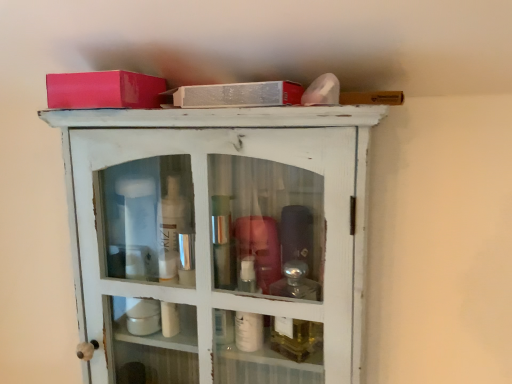
Question: From a real-world perspective, relative to white distressed wood cabinet at upper center, is matte pink box at upper left vertically above or below?

Choices:
 (A) above
 (B) below

Answer: (A)

Question: Would you say matte pink box at upper left is to the left or to the right of white distressed wood cabinet at upper center in the picture?

Choices:
 (A) left
 (B) right

Answer: (A)

Question: Looking at the image, does matte pink box at upper left seem bigger or smaller compared to white distressed wood cabinet at upper center?

Choices:
 (A) small
 (B) big

Answer: (A)

Question: In terms of size, does white distressed wood cabinet at upper center appear bigger or smaller than matte pink box at upper left?

Choices:
 (A) big
 (B) small

Answer: (A)

Question: From the image's perspective, is white distressed wood cabinet at upper center positioned above or below matte pink box at upper left?

Choices:
 (A) below
 (B) above

Answer: (A)

Question: In terms of height, does white distressed wood cabinet at upper center look taller or shorter compared to matte pink box at upper left?

Choices:
 (A) tall
 (B) short

Answer: (A)

Question: From a real-world perspective, is white distressed wood cabinet at upper center positioned above or below matte pink box at upper left?

Choices:
 (A) below
 (B) above

Answer: (A)